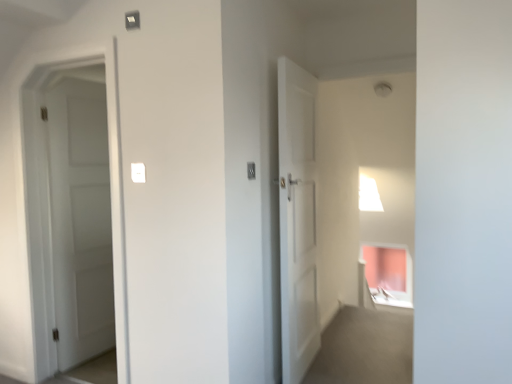
What do you see at coordinates (138, 172) in the screenshot?
I see `white plastic light switch at center, the 1th light switch positioned from the left` at bounding box center [138, 172].

Measure the distance between point (x=65, y=228) and camera.

They are 9.33 feet apart.

Identify the location of white plastic light switch at center, the second light switch when ordered from right to left. (138, 172).

Is white plastic light switch at center, marked as the 1th light switch in a right-to-left arrangement, looking in the opposite direction of white matte door at left?

That's right, white plastic light switch at center, marked as the 1th light switch in a right-to-left arrangement, is facing away from white matte door at left.

Which point is more forward, (x=253, y=174) or (x=65, y=150)?

The point (x=253, y=174) is more forward.

Looking at their sizes, would you say white plastic light switch at center, marked as the 1th light switch in a right-to-left arrangement, is wider or thinner than white matte door at left?

Clearly, white plastic light switch at center, marked as the 1th light switch in a right-to-left arrangement, has less width compared to white matte door at left.

Is white plastic light switch at center, the second light switch when ordered from left to right, next to white matte door at left and touching it?

white plastic light switch at center, the second light switch when ordered from left to right, is not next to white matte door at left, and they're not touching.

Is white plastic light switch at center, the 1th light switch positioned from the left, not within white plastic light switch at center, marked as the 1th light switch in a right-to-left arrangement?

Yes.

In the image, is white plastic light switch at center, the 1th light switch positioned from the left, positioned in front of or behind white plastic light switch at center, the second light switch when ordered from left to right?

In the image, white plastic light switch at center, the 1th light switch positioned from the left, appears in front of white plastic light switch at center, the second light switch when ordered from left to right.

Is white plastic light switch at center, the 1th light switch positioned from the left, at the left side of white plastic light switch at center, marked as the 1th light switch in a right-to-left arrangement?

Correct, you'll find white plastic light switch at center, the 1th light switch positioned from the left, to the left of white plastic light switch at center, marked as the 1th light switch in a right-to-left arrangement.

From a real-world perspective, which is physically below, white plastic light switch at center, the 1th light switch positioned from the left, or white plastic light switch at center, marked as the 1th light switch in a right-to-left arrangement?

white plastic light switch at center, the 1th light switch positioned from the left, is physically lower.

How different are the orientations of white plastic light switch at center, the 1th light switch positioned from the left, and white matte door at left in degrees?

The angle between the facing direction of white plastic light switch at center, the 1th light switch positioned from the left, and the facing direction of white matte door at left is 84.5 degrees.

Does white plastic light switch at center, the 1th light switch positioned from the left, have a smaller size compared to white matte door at left?

Indeed, white plastic light switch at center, the 1th light switch positioned from the left, has a smaller size compared to white matte door at left.

Between white plastic light switch at center, the 1th light switch positioned from the left, and white matte door at left, which one has smaller width?

white plastic light switch at center, the 1th light switch positioned from the left.

Which is in front, point (144, 172) or point (63, 344)?

Positioned in front is point (144, 172).

Is there a large distance between white matte door at left and white plastic light switch at center, marked as the 1th light switch in a right-to-left arrangement?

That's right, there is a large distance between white matte door at left and white plastic light switch at center, marked as the 1th light switch in a right-to-left arrangement.

Considering the relative positions of white matte door at left and white plastic light switch at center, marked as the 1th light switch in a right-to-left arrangement, in the image provided, is white matte door at left to the left or to the right of white plastic light switch at center, marked as the 1th light switch in a right-to-left arrangement,?

Clearly, white matte door at left is on the left of white plastic light switch at center, marked as the 1th light switch in a right-to-left arrangement, in the image.

Considering the sizes of objects white matte door at left and white plastic light switch at center, marked as the 1th light switch in a right-to-left arrangement, in the image provided, who is wider, white matte door at left or white plastic light switch at center, marked as the 1th light switch in a right-to-left arrangement,?

white matte door at left.

Does white plastic light switch at center, marked as the 1th light switch in a right-to-left arrangement, have a smaller size compared to white plastic light switch at center, the second light switch when ordered from right to left?

Incorrect, white plastic light switch at center, marked as the 1th light switch in a right-to-left arrangement, is not smaller in size than white plastic light switch at center, the second light switch when ordered from right to left.

Is point (252, 164) positioned before point (133, 175)?

No, (252, 164) is further to viewer.

Considering the sizes of objects white plastic light switch at center, the second light switch when ordered from left to right, and white plastic light switch at center, the second light switch when ordered from right to left, in the image provided, who is thinner, white plastic light switch at center, the second light switch when ordered from left to right, or white plastic light switch at center, the second light switch when ordered from right to left,?

white plastic light switch at center, the second light switch when ordered from right to left.

From the image's perspective, is white plastic light switch at center, the second light switch when ordered from left to right, on white plastic light switch at center, the 1th light switch positioned from the left?

Yes.

Would you say white matte door at left is a long distance from white plastic light switch at center, the 1th light switch positioned from the left?

white matte door at left is positioned a significant distance from white plastic light switch at center, the 1th light switch positioned from the left.

From the image's perspective, between white matte door at left and white plastic light switch at center, the 1th light switch positioned from the left, which one is located above?

white plastic light switch at center, the 1th light switch positioned from the left, is shown above in the image.

Is white matte door at left positioned with its back to white plastic light switch at center, the 1th light switch positioned from the left?

No, white matte door at left is not facing the opposite direction of white plastic light switch at center, the 1th light switch positioned from the left.

Who is bigger, white matte door at left or white plastic light switch at center, the 1th light switch positioned from the left?

With larger size is white matte door at left.

Image resolution: width=512 pixels, height=384 pixels. Identify the location of door below the white plastic light switch at center, the second light switch when ordered from left to right (from a real-world perspective). (80, 220).

What are the coordinates of `light switch that is above the white plastic light switch at center, the 1th light switch positioned from the left (from a real-world perspective)` in the screenshot? It's located at [x=251, y=171].

Considering their positions, is white plastic light switch at center, the second light switch when ordered from right to left, positioned further to white plastic light switch at center, marked as the 1th light switch in a right-to-left arrangement, than white matte door at left?

white matte door at left is positioned further to the anchor white plastic light switch at center, marked as the 1th light switch in a right-to-left arrangement.

Looking at the image, which one is located further to white plastic light switch at center, the 1th light switch positioned from the left, white plastic light switch at center, marked as the 1th light switch in a right-to-left arrangement, or white matte door at left?

The object further to white plastic light switch at center, the 1th light switch positioned from the left, is white matte door at left.

Considering their positions, is white matte door at left positioned further to white plastic light switch at center, marked as the 1th light switch in a right-to-left arrangement, than white plastic light switch at center, the second light switch when ordered from right to left?

white matte door at left.

From the image, which object appears to be nearer to white plastic light switch at center, the second light switch when ordered from right to left, white matte door at left or white plastic light switch at center, marked as the 1th light switch in a right-to-left arrangement?

Based on the image, white plastic light switch at center, marked as the 1th light switch in a right-to-left arrangement, appears to be nearer to white plastic light switch at center, the second light switch when ordered from right to left.

Estimate the real-world distances between objects in this image. Which object is closer to white matte door at left, white plastic light switch at center, the second light switch when ordered from left to right, or white plastic light switch at center, the second light switch when ordered from right to left?

Based on the image, white plastic light switch at center, the second light switch when ordered from right to left, appears to be nearer to white matte door at left.

From the image, which object appears to be farther from white matte door at left, white plastic light switch at center, the 1th light switch positioned from the left, or white plastic light switch at center, the second light switch when ordered from left to right?

Based on the image, white plastic light switch at center, the second light switch when ordered from left to right, appears to be further to white matte door at left.

Locate an element on the screen. This screenshot has height=384, width=512. light switch between white matte door at left and white plastic light switch at center, the second light switch when ordered from left to right, from left to right is located at coordinates (138, 172).